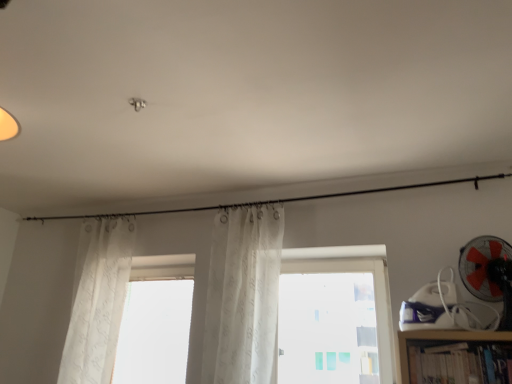
Question: Does red plastic fan at right appear on the left side of hardcover book at lower right?

Choices:
 (A) no
 (B) yes

Answer: (A)

Question: Is hardcover book at lower right at the back of red plastic fan at right?

Choices:
 (A) no
 (B) yes

Answer: (A)

Question: Is red plastic fan at right taller than hardcover book at lower right?

Choices:
 (A) yes
 (B) no

Answer: (A)

Question: Is red plastic fan at right in contact with hardcover book at lower right?

Choices:
 (A) no
 (B) yes

Answer: (A)

Question: From the image's perspective, does red plastic fan at right appear lower than hardcover book at lower right?

Choices:
 (A) yes
 (B) no

Answer: (B)

Question: Considering the relative sizes of red plastic fan at right and hardcover book at lower right in the image provided, is red plastic fan at right thinner than hardcover book at lower right?

Choices:
 (A) no
 (B) yes

Answer: (A)

Question: Is translucent white curtain at left, which is counted as the first curtain, starting from the left, positioned far away from transparent glass window at center?

Choices:
 (A) yes
 (B) no

Answer: (A)

Question: Is translucent white curtain at left, which is counted as the first curtain, starting from the left, located outside transparent glass window at center?

Choices:
 (A) no
 (B) yes

Answer: (B)

Question: Is translucent white curtain at left, positioned as the second curtain in right-to-left order, directly adjacent to transparent glass window at center?

Choices:
 (A) no
 (B) yes

Answer: (A)

Question: Could you tell me if translucent white curtain at left, which is counted as the first curtain, starting from the left, is turned towards transparent glass window at center?

Choices:
 (A) no
 (B) yes

Answer: (A)

Question: Can you confirm if translucent white curtain at left, which is counted as the first curtain, starting from the left, is thinner than transparent glass window at center?

Choices:
 (A) no
 (B) yes

Answer: (B)

Question: Is transparent glass window at center completely or partially inside translucent white curtain at left, positioned as the second curtain in right-to-left order?

Choices:
 (A) no
 (B) yes

Answer: (A)

Question: Considering the relative sizes of white sheer curtain at center, the first curtain when ordered from right to left, and transparent glass window at center in the image provided, is white sheer curtain at center, the first curtain when ordered from right to left, taller than transparent glass window at center?

Choices:
 (A) yes
 (B) no

Answer: (A)